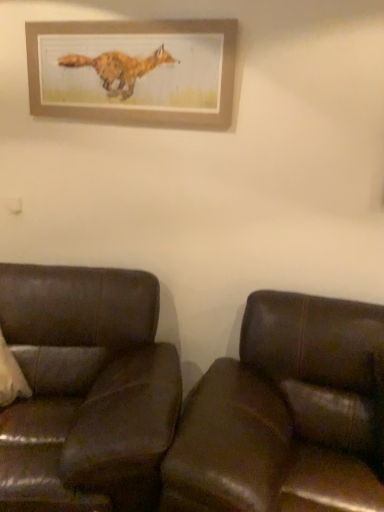
Question: Relative to brown leather couch at left, which is the 1th studio couch from left to right, is brown leather couch at lower right, marked as the 1th studio couch in a right-to-left arrangement, in front or behind?

Choices:
 (A) front
 (B) behind

Answer: (A)

Question: Is brown leather couch at lower right, marked as the 1th studio couch in a right-to-left arrangement, inside the boundaries of brown leather couch at left, which is the 1th studio couch from left to right, or outside?

Choices:
 (A) outside
 (B) inside

Answer: (A)

Question: Based on their relative distances, which object is farther from the brown leather couch at lower right, marked as the 1th studio couch in a right-to-left arrangement?

Choices:
 (A) wooden picture frame at upper center
 (B) brown leather couch at left, which is the 1th studio couch from left to right

Answer: (A)

Question: Which is nearer to the brown leather couch at lower right, marked as the 1th studio couch in a right-to-left arrangement?

Choices:
 (A) wooden picture frame at upper center
 (B) brown leather couch at left, the 2th studio couch from the right

Answer: (B)